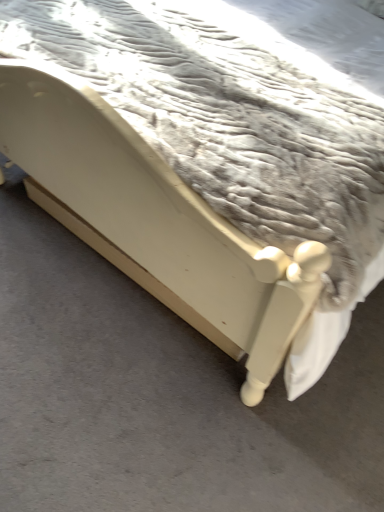
You are a GUI agent. You are given a task and a screenshot of the screen. Output one action in this format:
    pyautogui.click(x=<x>, y=<y>)
    Task: Click on the matte white bedpost at lower center
    
    Given the screenshot: What is the action you would take?
    pyautogui.click(x=162, y=397)

The width and height of the screenshot is (384, 512). Describe the element at coordinates (162, 397) in the screenshot. I see `matte white bedpost at lower center` at that location.

Locate an element on the screen. This screenshot has height=512, width=384. matte white bedpost at lower center is located at coordinates (162, 397).